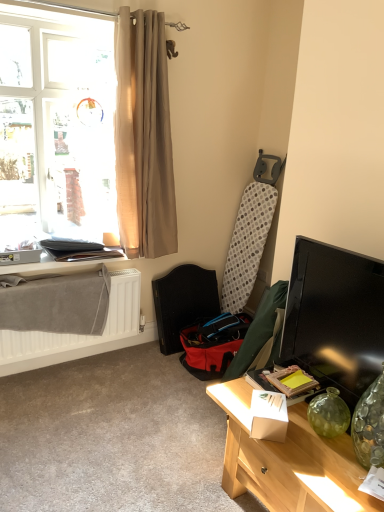
Question: Looking at the image, does beige fabric curtain at upper left seem bigger or smaller compared to light wood desk at lower right?

Choices:
 (A) big
 (B) small

Answer: (B)

Question: Is beige fabric curtain at upper left situated inside light wood desk at lower right or outside?

Choices:
 (A) inside
 (B) outside

Answer: (B)

Question: Estimate the real-world distances between objects in this image. Which object is closer to the light wood desk at lower right?

Choices:
 (A) matte black table at lower left
 (B) beige fabric curtain at upper left
 (C) translucent fabric window at upper left
 (D) black glossy tv at right
 (E) red fabric folding chair at center

Answer: (D)

Question: Which object is positioned farthest from the black glossy tv at right?

Choices:
 (A) red fabric folding chair at center
 (B) matte black table at lower left
 (C) beige fabric curtain at upper left
 (D) light wood desk at lower right
 (E) translucent fabric window at upper left

Answer: (B)